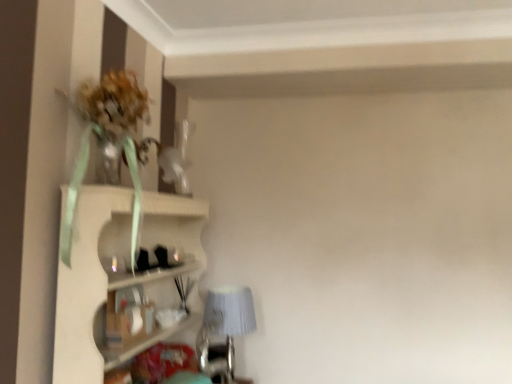
Question: Is the depth of textured gray lampshade at lower center less than that of white textured shelf at upper left?

Choices:
 (A) no
 (B) yes

Answer: (A)

Question: Is textured gray lampshade at lower center further to camera compared to white textured shelf at upper left?

Choices:
 (A) yes
 (B) no

Answer: (A)

Question: Is textured gray lampshade at lower center next to white textured shelf at upper left and touching it?

Choices:
 (A) no
 (B) yes

Answer: (A)

Question: Is textured gray lampshade at lower center to the left of white textured shelf at upper left from the viewer's perspective?

Choices:
 (A) no
 (B) yes

Answer: (A)

Question: From the image's perspective, is textured gray lampshade at lower center on top of white textured shelf at upper left?

Choices:
 (A) yes
 (B) no

Answer: (B)

Question: Can we say textured gray lampshade at lower center lies outside white textured shelf at upper left?

Choices:
 (A) yes
 (B) no

Answer: (B)

Question: Does white textured shelf at upper left have a greater width compared to textured gray lampshade at lower center?

Choices:
 (A) no
 (B) yes

Answer: (B)

Question: Could you tell me if white textured shelf at upper left is turned towards textured gray lampshade at lower center?

Choices:
 (A) yes
 (B) no

Answer: (A)

Question: Would you say white textured shelf at upper left is a long distance from textured gray lampshade at lower center?

Choices:
 (A) no
 (B) yes

Answer: (A)

Question: Can you confirm if white textured shelf at upper left is taller than textured gray lampshade at lower center?

Choices:
 (A) no
 (B) yes

Answer: (B)

Question: Is white textured shelf at upper left smaller than textured gray lampshade at lower center?

Choices:
 (A) no
 (B) yes

Answer: (A)

Question: Can you confirm if white textured shelf at upper left is thinner than textured gray lampshade at lower center?

Choices:
 (A) no
 (B) yes

Answer: (A)

Question: Is textured gray lampshade at lower center in front of or behind white textured shelf at upper left in the image?

Choices:
 (A) behind
 (B) front

Answer: (A)